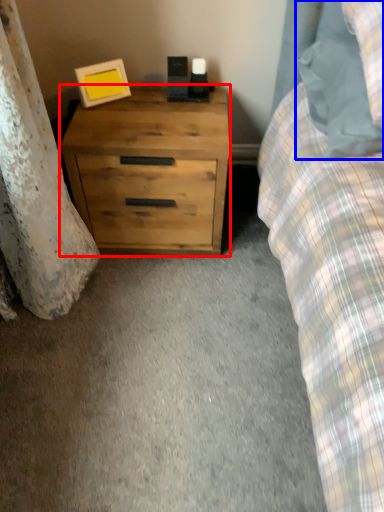
Question: Which of the following is the farthest to the observer, chest of drawers (highlighted by a red box) or pillow (highlighted by a blue box)?

Choices:
 (A) chest of drawers
 (B) pillow

Answer: (A)